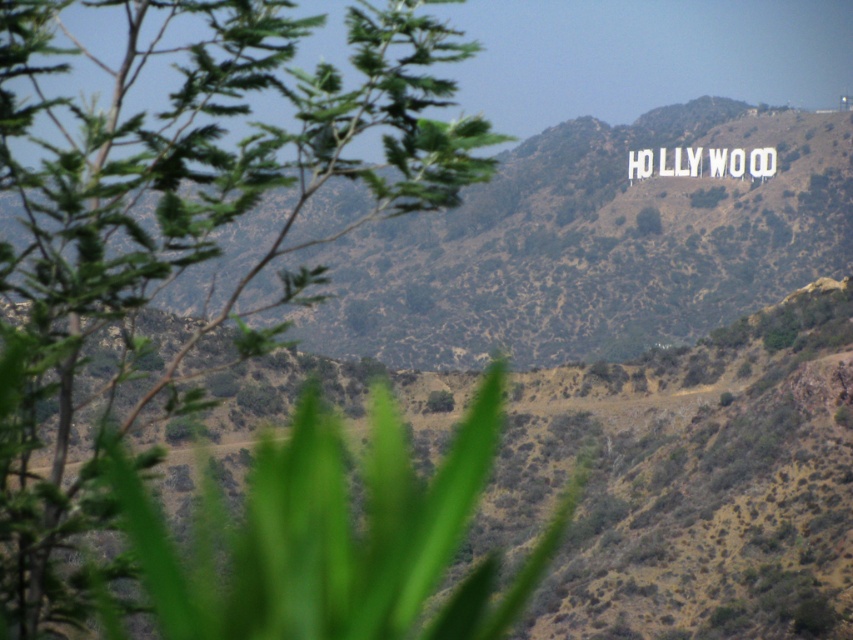
You are a photographer trying to capture the Hollywood sign in the background. You notice the green leafy tree at left and the green grassy hillside at upper center. Which object is bigger in the photo?

The green leafy tree at left is larger in size compared to the green grassy hillside at upper center.

You are standing in front of the Hollywood sign and notice a green leafy tree at left. Based on its 2D location coordinates, can you determine if the tree is closer to the bottom or the top of the image?

The green leafy tree at left is located at coordinates point [177,224]. Since the y coordinate is 0.209, which is closer to the bottom of the image, the tree is closer to the bottom.